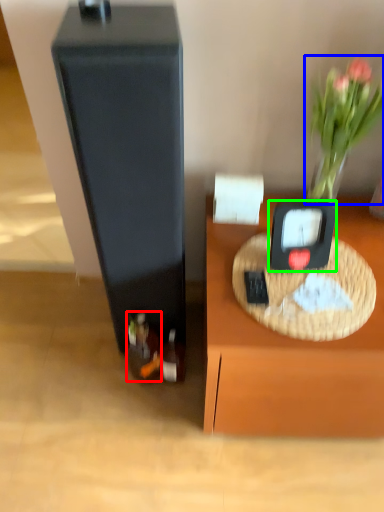
Question: Which is farther away from wine bottle (highlighted by a red box)? plant (highlighted by a blue box) or weight scale (highlighted by a green box)?

Choices:
 (A) plant
 (B) weight scale

Answer: (A)